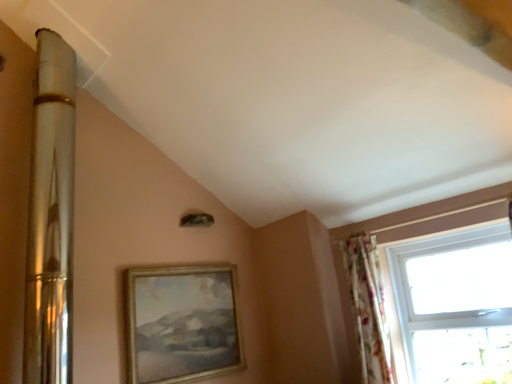
Question: Is gold/golden wood picture frame at center facing towards floral fabric curtain at right?

Choices:
 (A) yes
 (B) no

Answer: (A)

Question: Can floral fabric curtain at right be found inside gold/golden wood picture frame at center?

Choices:
 (A) no
 (B) yes

Answer: (A)

Question: Considering the relative sizes of gold/golden wood picture frame at center and floral fabric curtain at right in the image provided, is gold/golden wood picture frame at center wider than floral fabric curtain at right?

Choices:
 (A) yes
 (B) no

Answer: (B)

Question: Is gold/golden wood picture frame at center outside floral fabric curtain at right?

Choices:
 (A) no
 (B) yes

Answer: (B)

Question: Considering the relative positions of gold/golden wood picture frame at center and floral fabric curtain at right in the image provided, is gold/golden wood picture frame at center in front of floral fabric curtain at right?

Choices:
 (A) no
 (B) yes

Answer: (B)

Question: Can you confirm if gold/golden wood picture frame at center is bigger than floral fabric curtain at right?

Choices:
 (A) yes
 (B) no

Answer: (A)

Question: Would you say gold/golden wood picture frame at center contains transparent glass window at right?

Choices:
 (A) no
 (B) yes

Answer: (A)

Question: Is gold/golden wood picture frame at center bigger than transparent glass window at right?

Choices:
 (A) no
 (B) yes

Answer: (B)

Question: From a real-world perspective, is gold/golden wood picture frame at center under transparent glass window at right?

Choices:
 (A) yes
 (B) no

Answer: (B)

Question: Does gold/golden wood picture frame at center have a smaller size compared to transparent glass window at right?

Choices:
 (A) yes
 (B) no

Answer: (B)

Question: Would you say gold/golden wood picture frame at center is a long distance from transparent glass window at right?

Choices:
 (A) yes
 (B) no

Answer: (A)

Question: Is the depth of gold/golden wood picture frame at center greater than that of transparent glass window at right?

Choices:
 (A) no
 (B) yes

Answer: (B)

Question: Are transparent glass window at right and floral fabric curtain at right far apart?

Choices:
 (A) no
 (B) yes

Answer: (A)